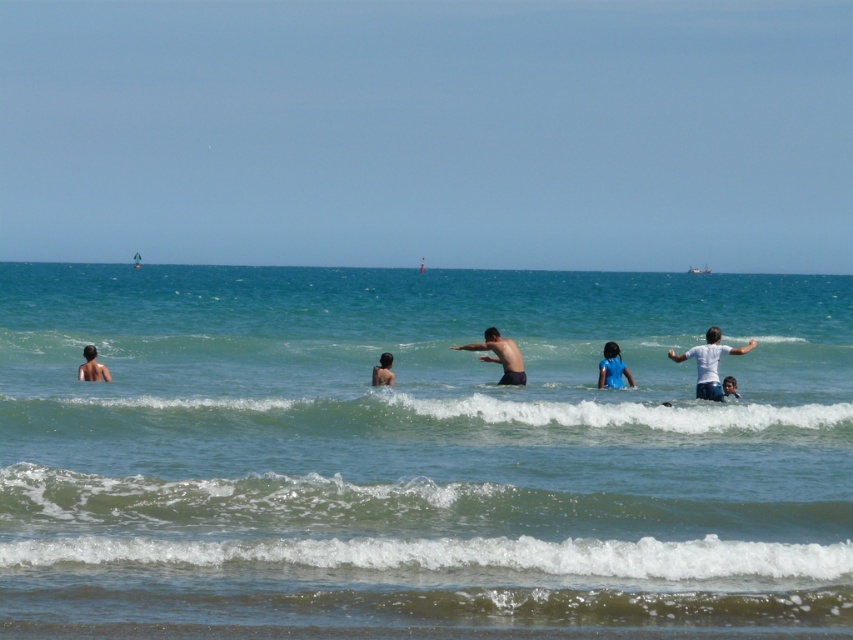
Question: Among these points, which one is nearest to the camera?

Choices:
 (A) (589, 301)
 (B) (700, 385)
 (C) (389, 365)
 (D) (483, 422)

Answer: (D)

Question: Is matte skin person at left bigger than smooth skin person at center?

Choices:
 (A) no
 (B) yes

Answer: (B)

Question: Does blue matte swimsuit at center come in front of smooth skin person at center?

Choices:
 (A) yes
 (B) no

Answer: (B)

Question: Which point is closer to the camera?

Choices:
 (A) clear blue water at center
 (B) white matte shirt at upper right
 (C) smooth skin person at center
 (D) matte skin person at left

Answer: (A)

Question: Does greenish-blue water at center have a greater width compared to dark skin surfer at center?

Choices:
 (A) no
 (B) yes

Answer: (B)

Question: Which point is closer to the camera?

Choices:
 (A) (619, 618)
 (B) (86, 356)

Answer: (A)